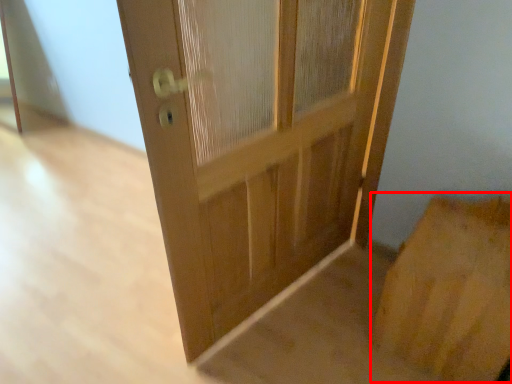
Question: From the image's perspective, where is cardboard box (annotated by the red box) located in relation to door in the image?

Choices:
 (A) below
 (B) above

Answer: (A)